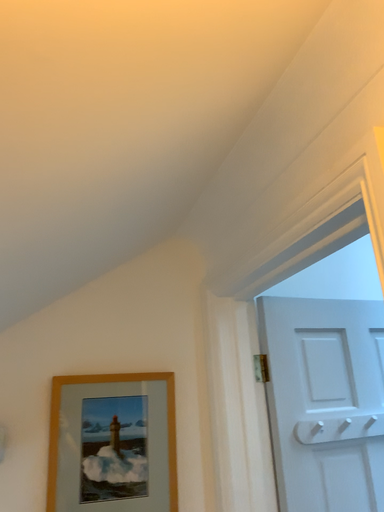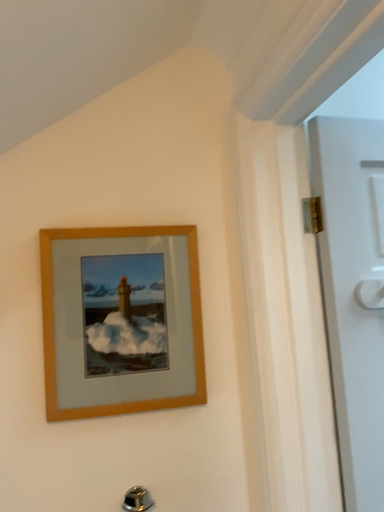
Question: How did the camera likely rotate when shooting the video?

Choices:
 (A) rotated upward
 (B) rotated downward

Answer: (B)